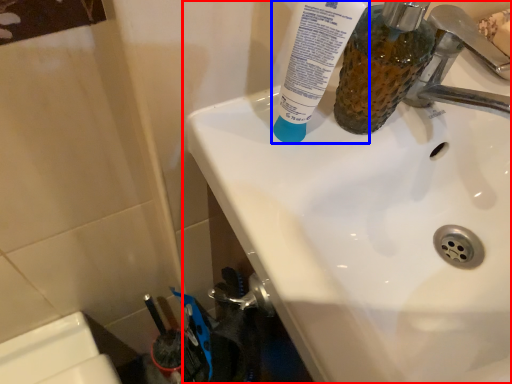
Question: Which point is further to the camera, sink (highlighted by a red box) or toothpaste (highlighted by a blue box)?

Choices:
 (A) sink
 (B) toothpaste

Answer: (B)